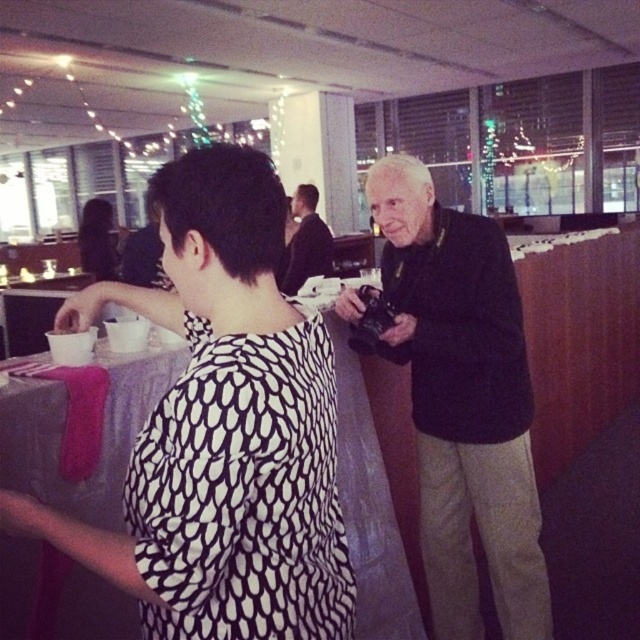
You are a photographer standing at the entrance of the room. You want to take a photo that includes both the black matte jacket at center and the matte black hair at upper left. Given that your camera has a maximum focus range of 4 meters, will you be able to capture both subjects in focus without moving closer?

The distance between the black matte jacket at center and matte black hair at upper left is 4.47 meters, which exceeds the camera maximum focus range of 4 meters. Therefore, you will not be able to capture both subjects in focus without moving closer.

You are at a party and want to approach the person wearing the black smooth suit at center. Which direction should you move relative to the matte black hair at upper left?

You should move forward towards the black smooth suit at center since it is in front of the matte black hair at upper left, meaning the matte black hair at upper left is behind the black smooth suit at center.